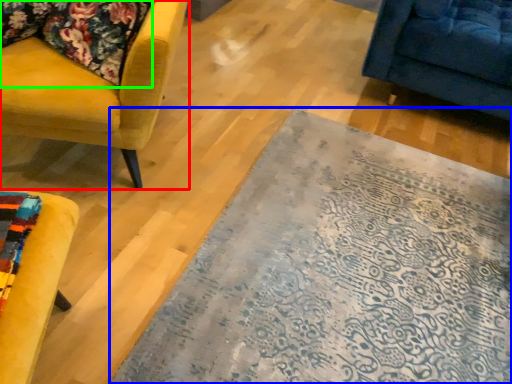
Question: Which object is positioned farthest from chair (highlighted by a red box)? Select from mat (highlighted by a blue box) and fabric (highlighted by a green box).

Choices:
 (A) mat
 (B) fabric

Answer: (A)